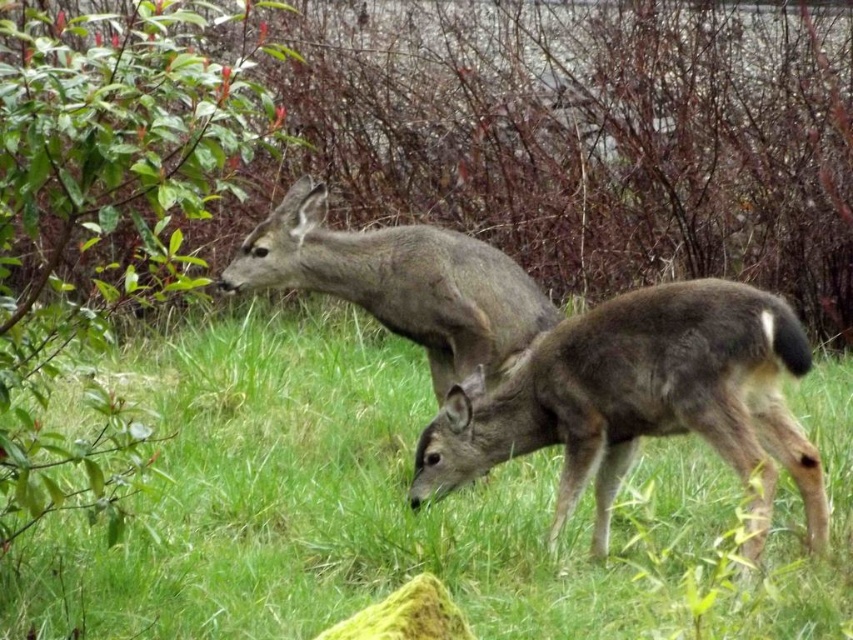
Does green grassy at center have a lesser width compared to brown fur roe deer at center?

In fact, green grassy at center might be wider than brown fur roe deer at center.

Can you confirm if green grassy at center is taller than brown fur roe deer at center?

Indeed, green grassy at center has a greater height compared to brown fur roe deer at center.

Which is in front, point (148, 356) or point (450, 490)?

Point (450, 490) is more forward.

Identify the location of green grassy at center. (403, 509).

Is brown fur roe deer at center smaller than gray fur roe deer at center?

No, brown fur roe deer at center is not smaller than gray fur roe deer at center.

Who is lower down, brown fur roe deer at center or gray fur roe deer at center?

Positioned lower is brown fur roe deer at center.

Find the location of a particular element. Image resolution: width=853 pixels, height=640 pixels. brown fur roe deer at center is located at coordinates (639, 401).

Image resolution: width=853 pixels, height=640 pixels. Find the location of `brown fur roe deer at center`. brown fur roe deer at center is located at coordinates (639, 401).

Does green grassy at center appear on the right side of gray fur roe deer at center?

Yes, green grassy at center is to the right of gray fur roe deer at center.

In the scene shown: Which of these two, green grassy at center or gray fur roe deer at center, stands taller?

With more height is green grassy at center.

Image resolution: width=853 pixels, height=640 pixels. What do you see at coordinates (403, 509) in the screenshot? I see `green grassy at center` at bounding box center [403, 509].

At what (x,y) coordinates should I click in order to perform the action: click on green grassy at center. Please return your answer as a coordinate pair (x, y). Looking at the image, I should click on (403, 509).